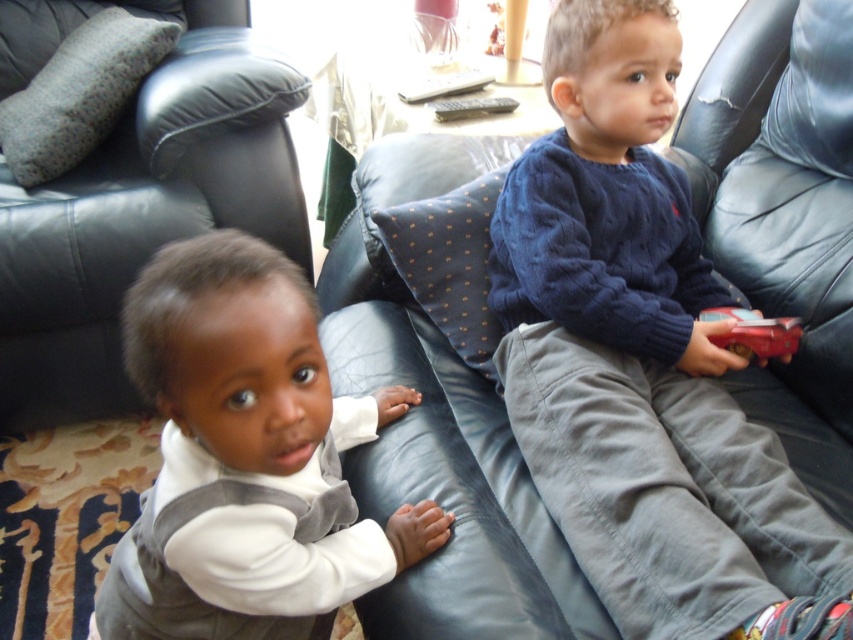
Is white soft vest at lower left smaller than black plastic remote at center?

No.

Between point (289, 467) and point (509, 108), which one is positioned behind?

Point (509, 108)

You are a GUI agent. You are given a task and a screenshot of the screen. Output one action in this format:
    pyautogui.click(x=<x>, y=<y>)
    Task: Click on the white soft vest at lower left
    
    Given the screenshot: What is the action you would take?
    pyautogui.click(x=247, y=458)

Which of these two, cable-knit sweater at center or black plastic remote at center, stands shorter?

black plastic remote at center is shorter.

Does point (512, 324) come farther from viewer compared to point (437, 106)?

No, it is in front of (437, 106).

This screenshot has width=853, height=640. Identify the location of cable-knit sweater at center. [x=637, y=356].

Is cable-knit sweater at center closer to the viewer compared to white soft vest at lower left?

No, cable-knit sweater at center is further to the viewer.

At what (x,y) coordinates should I click in order to perform the action: click on cable-knit sweater at center. Please return your answer as a coordinate pair (x, y). Looking at the image, I should click on (637, 356).

I want to click on cable-knit sweater at center, so click(637, 356).